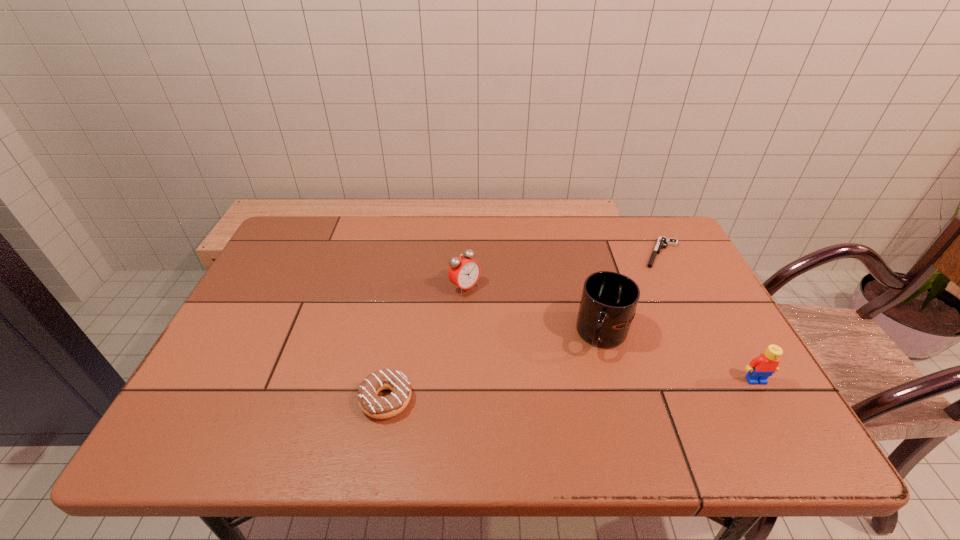
At what (x,y) coordinates should I click in order to perform the action: click on free space at the far left corner of the desktop. Please return your answer as a coordinate pair (x, y). The height and width of the screenshot is (540, 960). Looking at the image, I should click on (336, 216).

This screenshot has width=960, height=540. I want to click on free area in between the fourth nearest object and the pistol, so click(x=564, y=271).

Image resolution: width=960 pixels, height=540 pixels. What are the coordinates of `vacant space that is in between the leftmost object and the Lego` in the screenshot? It's located at (571, 390).

You are a GUI agent. You are given a task and a screenshot of the screen. Output one action in this format:
    pyautogui.click(x=<x>, y=<y>)
    Task: Click on the free space between the leftmost object and the Lego
    This screenshot has width=960, height=540.
    Given the screenshot: What is the action you would take?
    pyautogui.click(x=571, y=390)

Locate an element on the screen. The image size is (960, 540). free space between the shortest object and the Lego is located at coordinates (708, 316).

Locate an element on the screen. The height and width of the screenshot is (540, 960). free spot between the second object from left to right and the farthest object is located at coordinates coord(564,271).

Find the location of a particular element. Image resolution: width=960 pixels, height=540 pixels. vacant area that lies between the alarm clock and the tallest object is located at coordinates (534, 311).

What are the coordinates of `unoccupied area between the Lego and the mug` in the screenshot? It's located at (680, 357).

I want to click on free space between the tallest object and the leftmost object, so click(x=494, y=367).

Locate which object is the second closest to the Lego. Please provide its 2D coordinates. Your answer should be formatted as a tuple, i.e. [(x, y)], where the tuple contains the x and y coordinates of a point satisfying the conditions above.

[(662, 242)]